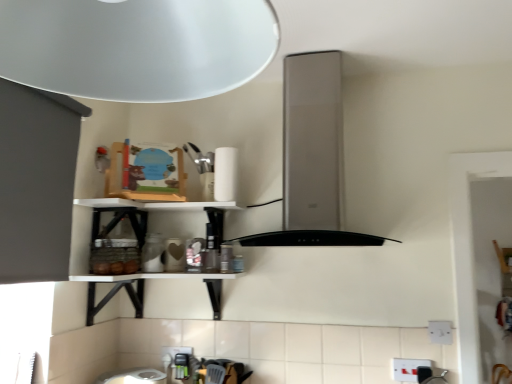
Question: From a real-world perspective, is white plastic electric outlet at lower right, which ranks as the 1th electric outlet in front-to-back order, on white plastic electric outlet at lower center, the first electric outlet ordered from the bottom?

Choices:
 (A) no
 (B) yes

Answer: (A)

Question: Considering the relative positions of white plastic electric outlet at lower right, positioned as the second electric outlet in top-to-bottom order, and white plastic electric outlet at lower center, which is the 3th electric outlet in top-to-bottom order, in the image provided, is white plastic electric outlet at lower right, positioned as the second electric outlet in top-to-bottom order, in front of white plastic electric outlet at lower center, which is the 3th electric outlet in top-to-bottom order,?

Choices:
 (A) no
 (B) yes

Answer: (B)

Question: From the image's perspective, is white plastic electric outlet at lower right, which ranks as the 1th electric outlet in front-to-back order, over white plastic electric outlet at lower center, which is the 3th electric outlet from right to left?

Choices:
 (A) no
 (B) yes

Answer: (B)

Question: From a real-world perspective, is white plastic electric outlet at lower right, the 2th electric outlet ordered from the bottom, physically below white plastic electric outlet at lower center, the first electric outlet ordered from the bottom?

Choices:
 (A) yes
 (B) no

Answer: (A)

Question: Is white plastic electric outlet at lower right, acting as the second electric outlet starting from the right, aimed at white plastic electric outlet at lower center, the 1th electric outlet viewed from the back?

Choices:
 (A) yes
 (B) no

Answer: (B)

Question: Does white plastic electric outlet at lower right, acting as the second electric outlet starting from the right, appear on the left side of white plastic electric outlet at lower center, which ranks as the 3th electric outlet in front-to-back order?

Choices:
 (A) yes
 (B) no

Answer: (B)

Question: Is satin silver vent at center oriented away from white plastic electric outlet at lower right, positioned as the 1th electric outlet in right-to-left order?

Choices:
 (A) yes
 (B) no

Answer: (B)

Question: Is the position of satin silver vent at center less distant than that of white plastic electric outlet at lower right, arranged as the 1th electric outlet when viewed from the top?

Choices:
 (A) no
 (B) yes

Answer: (B)

Question: Is satin silver vent at center touching white plastic electric outlet at lower right, the third electric outlet when ordered from left to right?

Choices:
 (A) yes
 (B) no

Answer: (B)

Question: Could you tell me if satin silver vent at center is turned towards white plastic electric outlet at lower right, the second electric outlet viewed from the back?

Choices:
 (A) no
 (B) yes

Answer: (A)

Question: Can you confirm if satin silver vent at center is taller than white plastic electric outlet at lower right, arranged as the 1th electric outlet when viewed from the top?

Choices:
 (A) yes
 (B) no

Answer: (A)

Question: Does satin silver vent at center have a smaller size compared to white plastic electric outlet at lower right, the third electric outlet when ordered from left to right?

Choices:
 (A) no
 (B) yes

Answer: (A)

Question: Can you confirm if white matte paper towel at upper center is bigger than white plastic electric outlet at lower right, the second electric outlet viewed from the back?

Choices:
 (A) yes
 (B) no

Answer: (A)